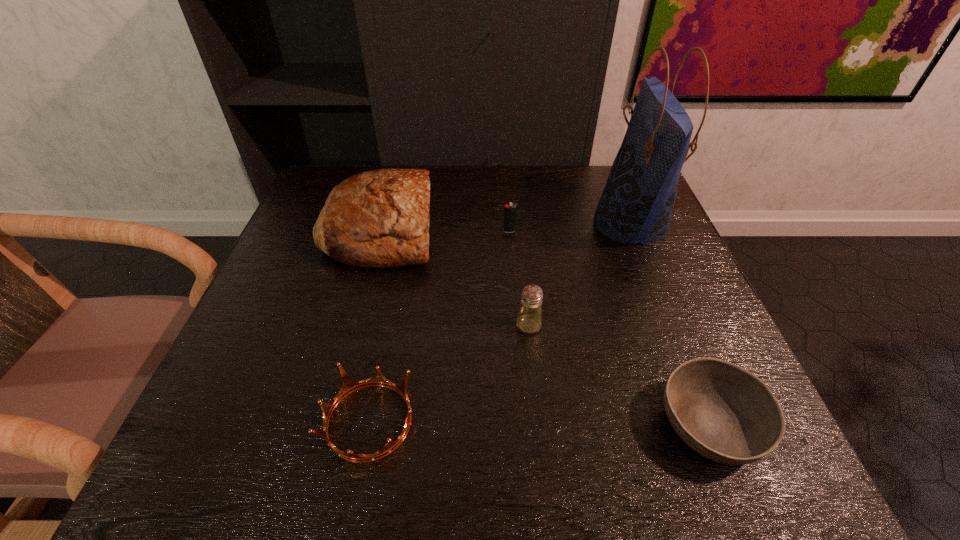
Identify the location of vacant position located on the front of the igniter. (512, 262).

What are the coordinates of `free location located on the right of the crown` in the screenshot? It's located at click(x=464, y=421).

Where is `vacant space located on the left of the bowl`? vacant space located on the left of the bowl is located at coordinates (499, 426).

Locate an element on the screen. shopping bag positioned at the far edge is located at coordinates (637, 202).

Locate an element on the screen. The image size is (960, 540). bread that is at the far edge is located at coordinates (380, 218).

Where is `crown that is at the near edge`? This screenshot has height=540, width=960. crown that is at the near edge is located at coordinates (348, 385).

This screenshot has width=960, height=540. Identify the location of bowl present at the near edge. (723, 412).

Image resolution: width=960 pixels, height=540 pixels. Find the location of `object that is at the left edge`. object that is at the left edge is located at coordinates (380, 218).

This screenshot has height=540, width=960. In order to click on shopping bag that is at the right edge in this screenshot , I will do `click(637, 202)`.

Identify the location of bowl that is at the right edge. (723, 412).